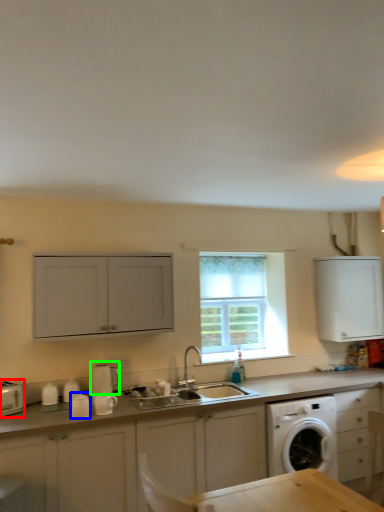
Question: Considering the real-world distances, which object is farthest from appliance (highlighted by a red box)? appliance (highlighted by a blue box) or appliance (highlighted by a green box)?

Choices:
 (A) appliance
 (B) appliance

Answer: (B)